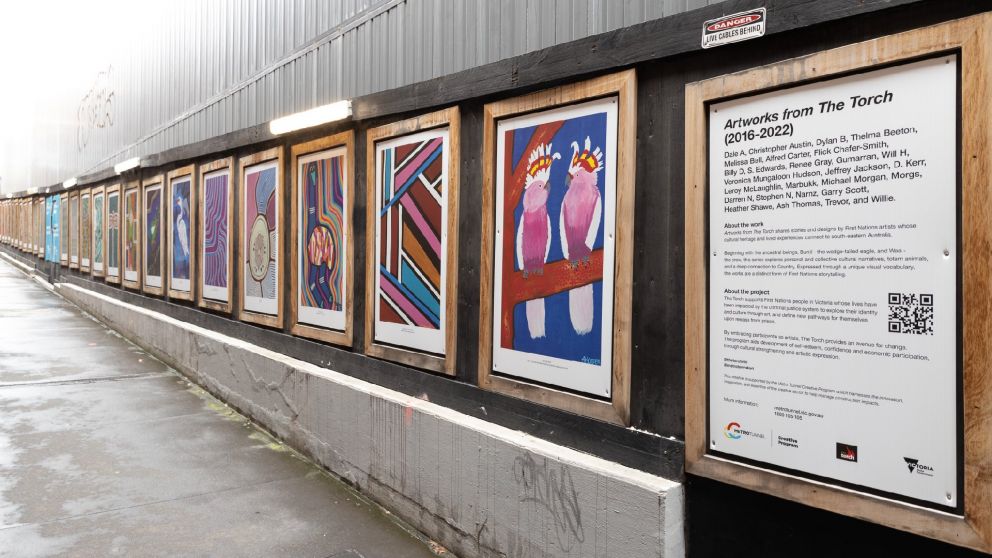
This screenshot has height=558, width=992. In order to click on nearest artwork in this screenshot , I will do `click(555, 227)`.